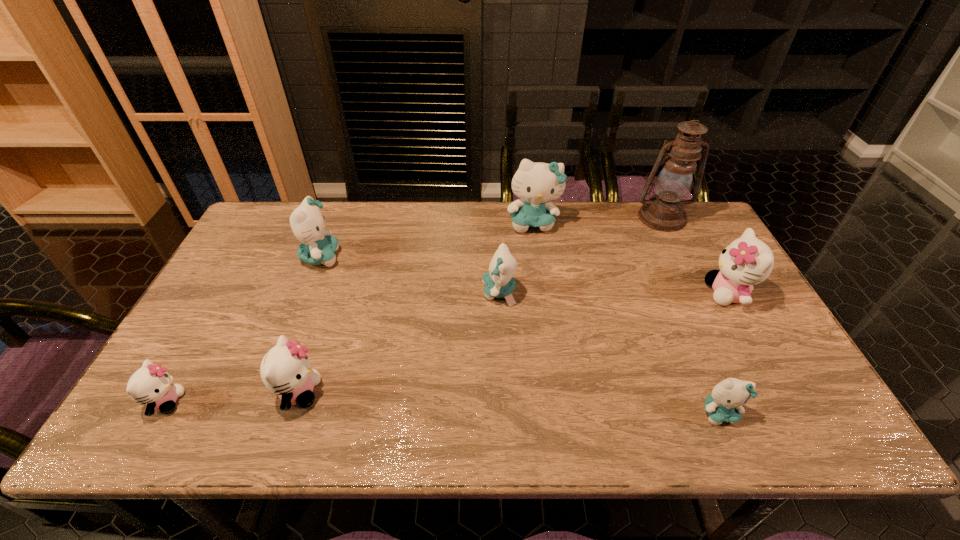
The height and width of the screenshot is (540, 960). I want to click on the tallest object, so click(x=664, y=211).

The width and height of the screenshot is (960, 540). I want to click on the farthest kitten, so click(536, 184).

Where is `the tallest kitten`? the tallest kitten is located at coordinates (536, 184).

The height and width of the screenshot is (540, 960). Find the location of `the second farthest blue kitten`. the second farthest blue kitten is located at coordinates (307, 222).

The height and width of the screenshot is (540, 960). Find the location of `the leftmost blue kitten`. the leftmost blue kitten is located at coordinates (307, 222).

Locate an element on the screen. the rightmost kitten is located at coordinates (747, 261).

Find the location of a particular element. the rightmost white kitten is located at coordinates (747, 261).

The image size is (960, 540). Find the location of `the third farthest blue kitten`. the third farthest blue kitten is located at coordinates (498, 282).

At what (x,y) coordinates should I click in order to perform the action: click on the second biggest white kitten. Please return your answer as a coordinate pair (x, y). Looking at the image, I should click on (x=285, y=369).

The width and height of the screenshot is (960, 540). What are the coordinates of `the smallest white kitten` in the screenshot? It's located at (151, 384).